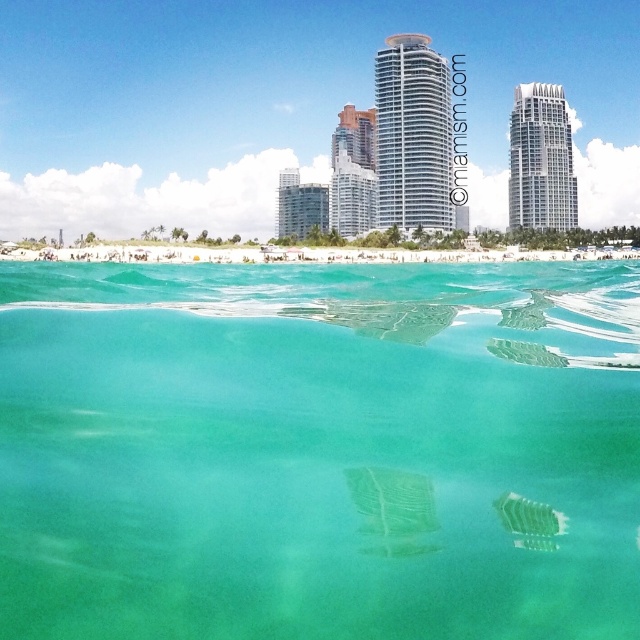
Question: Is the position of glassy teal skyscraper at center less distant than that of green sand at center?

Choices:
 (A) no
 (B) yes

Answer: (A)

Question: In this image, where is glassy teal skyscraper at center located relative to smooth glass skyscraper at center?

Choices:
 (A) left
 (B) right

Answer: (B)

Question: Is clear glass water at center closer to the viewer compared to smooth glass skyscraper at center?

Choices:
 (A) no
 (B) yes

Answer: (B)

Question: Among these objects, which one is nearest to the camera?

Choices:
 (A) smooth glass skyscraper at center
 (B) white glassy building at upper right
 (C) clear glass water at center

Answer: (C)

Question: Which object appears farthest from the camera in this image?

Choices:
 (A) smooth glass skyscraper at center
 (B) green sand at center
 (C) white glassy building at upper right
 (D) clear glass water at center

Answer: (C)

Question: Among these objects, which one is farthest from the camera?

Choices:
 (A) clear glass water at center
 (B) white glassy building at upper right

Answer: (B)